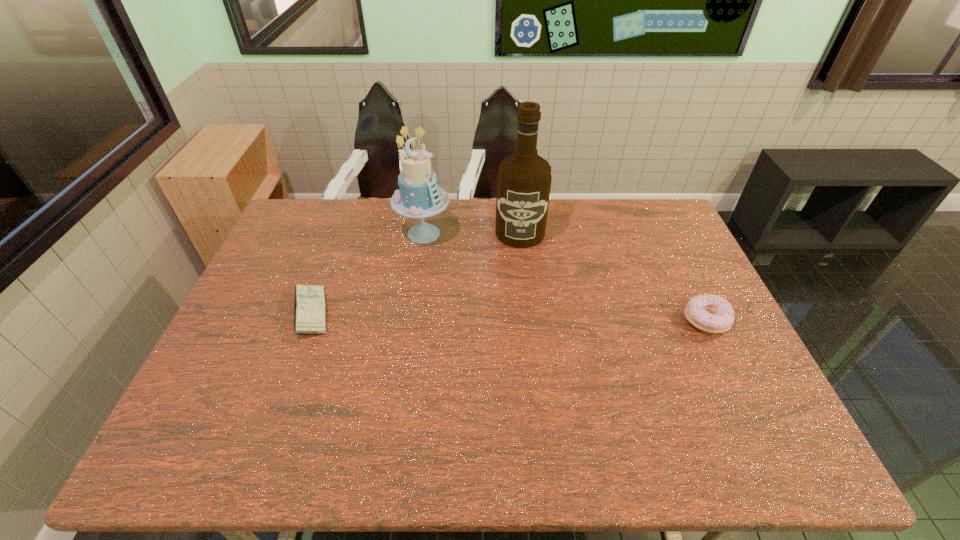
Locate an element on the screen. vacant space on the desktop that is between the leftmost object and the rightmost object and is positioned with a ladder on the side of the third shortest object is located at coordinates tap(460, 316).

Locate an element on the screen. The width and height of the screenshot is (960, 540). vacant space on the desktop that is between the leftmost object and the doughnut and is positioned on the label of the second object from right to left is located at coordinates coord(515,317).